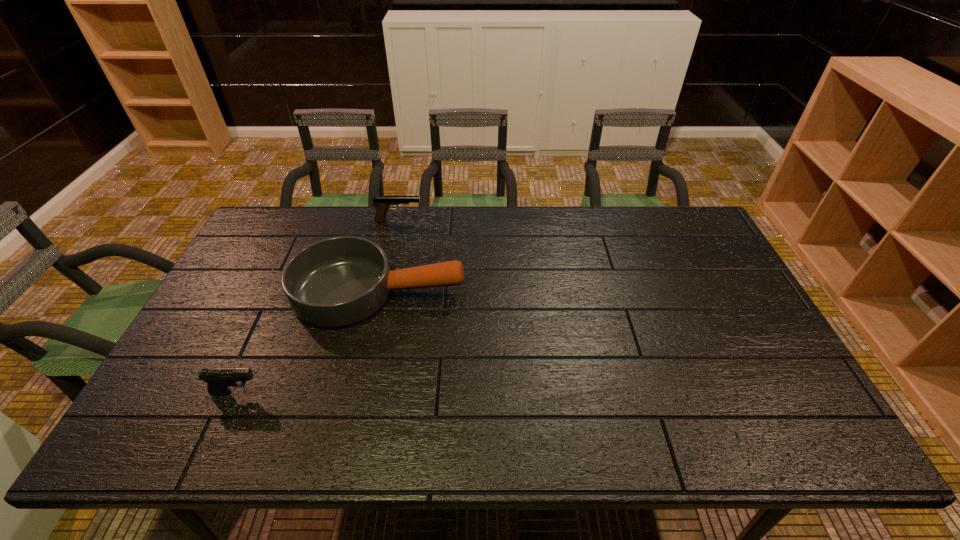
Where is `the second nearest object`? the second nearest object is located at coordinates (339, 281).

At what (x,y) coordinates should I click in order to perform the action: click on the farthest object. Please return your answer as a coordinate pair (x, y). This screenshot has width=960, height=540. Looking at the image, I should click on (382, 204).

Find the location of a particular element. the farther pistol is located at coordinates click(x=382, y=204).

Locate an element on the screen. the left pistol is located at coordinates (218, 379).

At what (x,y) coordinates should I click in order to perform the action: click on the nearer pistol. Please return your answer as a coordinate pair (x, y). The height and width of the screenshot is (540, 960). Looking at the image, I should click on tap(218, 379).

Locate an element on the screen. free space located on the handle side of the pan is located at coordinates (498, 292).

Locate an element on the screen. The width and height of the screenshot is (960, 540). vacant space located at the muzzle of the right pistol is located at coordinates (465, 220).

You are a GUI agent. You are given a task and a screenshot of the screen. Output one action in this format:
    pyautogui.click(x=<x>, y=<y>)
    Task: Click on the free space located at the barrel of the left pistol
    
    Given the screenshot: What is the action you would take?
    pyautogui.click(x=377, y=392)

This screenshot has height=540, width=960. In order to click on object positioned at the far edge in this screenshot , I will do `click(382, 204)`.

This screenshot has height=540, width=960. Identify the location of object present at the left edge. (218, 379).